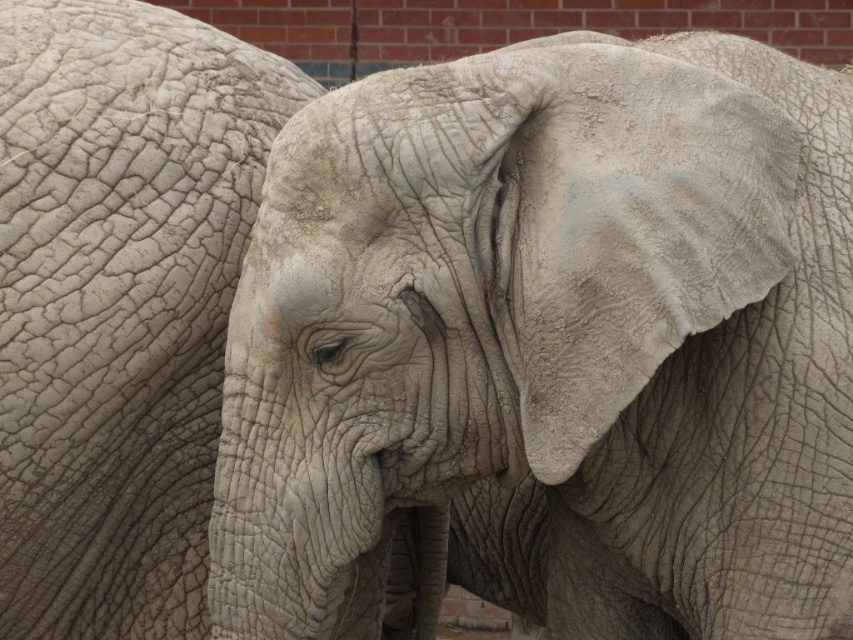
Is point (556, 188) positioned after point (144, 68)?

No, it is not.

Is gray textured elephant at center thinner than gray rough skin at left?

No, gray textured elephant at center is not thinner than gray rough skin at left.

Does point (643, 506) lie in front of point (49, 384)?

That is False.

This screenshot has height=640, width=853. What are the coordinates of `gray textured elephant at center` in the screenshot? It's located at (553, 326).